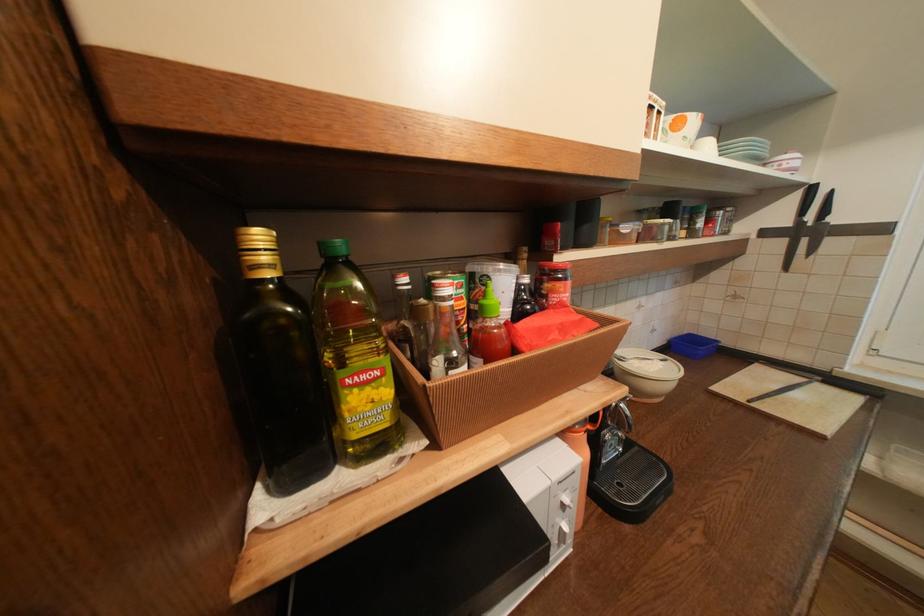
Locate an element on the screen. Image resolution: width=924 pixels, height=616 pixels. metal machine lever is located at coordinates (624, 435).